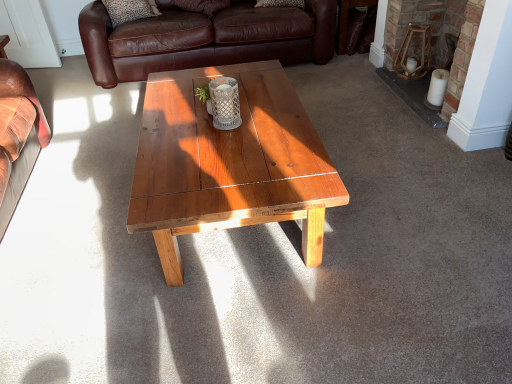
Question: Does brick fireplace at right lie behind brown leather couch at upper center?

Choices:
 (A) yes
 (B) no

Answer: (B)

Question: Is brick fireplace at right oriented towards brown leather couch at upper center?

Choices:
 (A) yes
 (B) no

Answer: (A)

Question: Considering the relative sizes of brick fireplace at right and brown leather couch at upper center in the image provided, is brick fireplace at right wider than brown leather couch at upper center?

Choices:
 (A) no
 (B) yes

Answer: (A)

Question: Considering the relative positions of brick fireplace at right and brown leather couch at upper center in the image provided, is brick fireplace at right in front of brown leather couch at upper center?

Choices:
 (A) yes
 (B) no

Answer: (A)

Question: From the image's perspective, is brick fireplace at right over brown leather couch at upper center?

Choices:
 (A) no
 (B) yes

Answer: (A)

Question: Considering their positions, is brick fireplace at right located in front of or behind brown leather side table at upper right?

Choices:
 (A) behind
 (B) front

Answer: (B)

Question: From a real-world perspective, is brick fireplace at right physically located above or below brown leather side table at upper right?

Choices:
 (A) below
 (B) above

Answer: (B)

Question: Considering the positions of brick fireplace at right and brown leather side table at upper right in the image, is brick fireplace at right taller or shorter than brown leather side table at upper right?

Choices:
 (A) tall
 (B) short

Answer: (A)

Question: In terms of size, does brick fireplace at right appear bigger or smaller than brown leather side table at upper right?

Choices:
 (A) small
 (B) big

Answer: (B)

Question: From their relative heights in the image, would you say brown leather side table at upper right is taller or shorter than wooden stool at upper right?

Choices:
 (A) short
 (B) tall

Answer: (B)

Question: Is brown leather side table at upper right in front of or behind wooden stool at upper right in the image?

Choices:
 (A) front
 (B) behind

Answer: (B)

Question: From a real-world perspective, is brown leather side table at upper right above or below wooden stool at upper right?

Choices:
 (A) below
 (B) above

Answer: (A)

Question: From the image's perspective, is brown leather side table at upper right above or below wooden stool at upper right?

Choices:
 (A) below
 (B) above

Answer: (B)

Question: In the image, is wooden stool at upper right on the left side or the right side of brick fireplace at right?

Choices:
 (A) left
 (B) right

Answer: (A)

Question: Is wooden stool at upper right in front of or behind brick fireplace at right in the image?

Choices:
 (A) front
 (B) behind

Answer: (B)